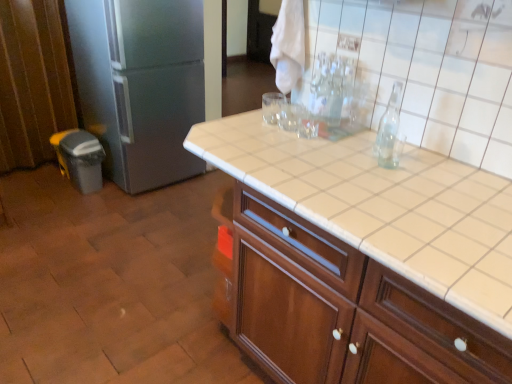
Question: Is satin silver refrigerator at left bigger or smaller than white tile countertop at center?

Choices:
 (A) small
 (B) big

Answer: (B)

Question: Considering their positions, is satin silver refrigerator at left located in front of or behind white tile countertop at center?

Choices:
 (A) front
 (B) behind

Answer: (B)

Question: Is point (93, 56) closer or farther from the camera than point (265, 177)?

Choices:
 (A) closer
 (B) farther

Answer: (B)

Question: From a real-world perspective, is white tile countertop at center positioned above or below satin silver refrigerator at left?

Choices:
 (A) below
 (B) above

Answer: (B)

Question: Is point (416, 208) closer or farther from the camera than point (155, 165)?

Choices:
 (A) farther
 (B) closer

Answer: (B)

Question: From their relative heights in the image, would you say white tile countertop at center is taller or shorter than satin silver refrigerator at left?

Choices:
 (A) tall
 (B) short

Answer: (B)

Question: Is white tile countertop at center in front of or behind satin silver refrigerator at left in the image?

Choices:
 (A) behind
 (B) front

Answer: (B)